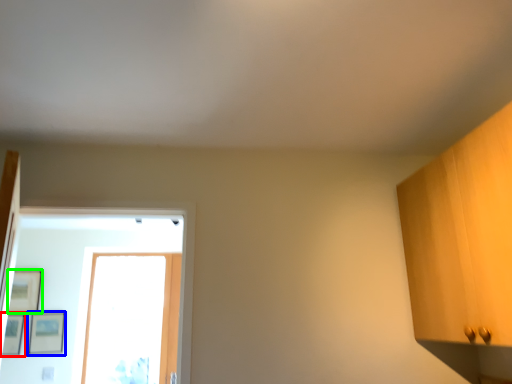
Question: Which object is positioned closest to picture frame (highlighted by a red box)? Select from picture frame (highlighted by a blue box) and picture frame (highlighted by a green box).

Choices:
 (A) picture frame
 (B) picture frame

Answer: (A)